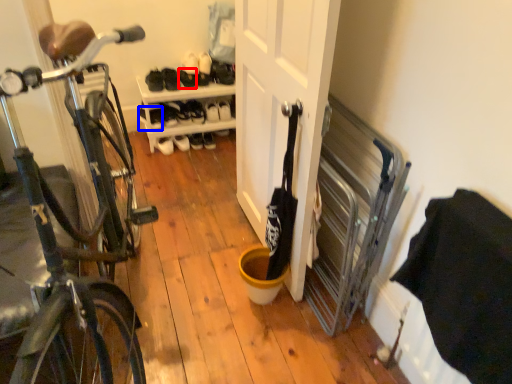
Question: Which of the following is the farthest to the observer, shoe (highlighted by a red box) or shoe (highlighted by a blue box)?

Choices:
 (A) shoe
 (B) shoe

Answer: (B)